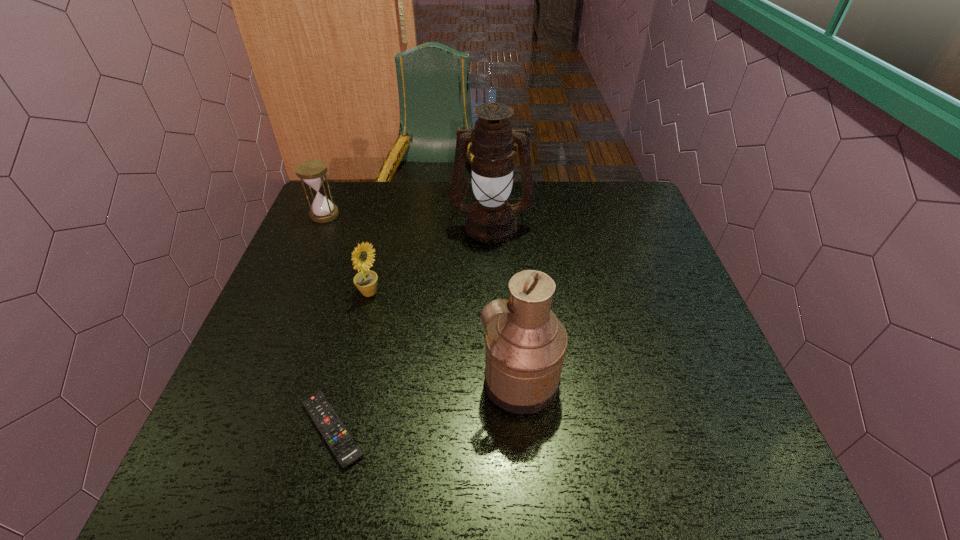
The width and height of the screenshot is (960, 540). I want to click on vacant space at the right edge of the desktop, so click(x=659, y=375).

Find the location of a particular element. The width and height of the screenshot is (960, 540). free space at the far left corner is located at coordinates (353, 213).

The height and width of the screenshot is (540, 960). In the image, there is a desktop. Identify the location of vacant space at the far right corner. (625, 212).

The height and width of the screenshot is (540, 960). In the image, there is a desktop. What are the coordinates of `free space at the near right corner` in the screenshot? It's located at (755, 493).

Find the location of `free space between the shortest object and the third farthest object`. free space between the shortest object and the third farthest object is located at coordinates (350, 361).

Identify the location of free point between the leftmost object and the second tallest object. The height and width of the screenshot is (540, 960). (422, 298).

Where is `free space between the third nearest object and the leftmost object`? free space between the third nearest object and the leftmost object is located at coordinates (347, 254).

Image resolution: width=960 pixels, height=540 pixels. I want to click on free spot between the shortest object and the oil lamp, so (x=412, y=327).

The width and height of the screenshot is (960, 540). I want to click on vacant space that is in between the remote control and the hourglass, so click(328, 322).

At what (x,y) coordinates should I click in order to perform the action: click on free area in between the leftmost object and the tallest object. Please return your answer as a coordinate pair (x, y). The height and width of the screenshot is (540, 960). Looking at the image, I should click on (408, 219).